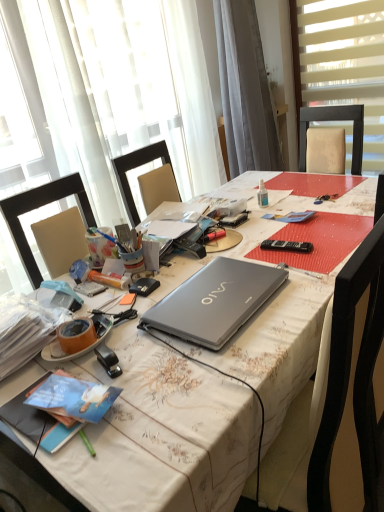
At what (x,y) coordinates should I click in order to perform the action: click on vacant area located to the right-hand side of matte plastic pencil at center-left. Please return your answer as a coordinate pair (x, y). The height and width of the screenshot is (512, 384). Looking at the image, I should click on (169, 274).